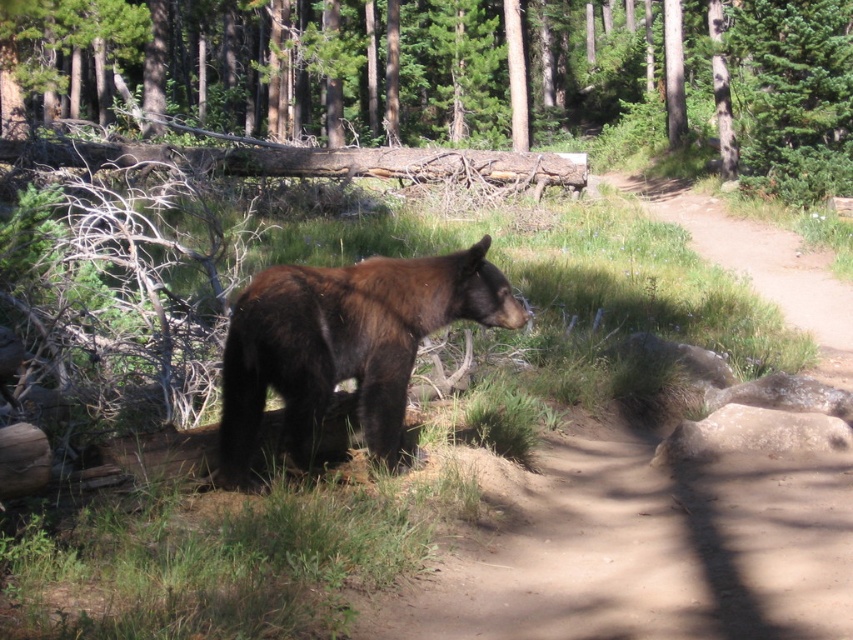
From the picture: Can you confirm if brown rough log at center is thinner than brown furry bear at center?

No.

In the scene shown: Who is more distant from viewer, (x=212, y=83) or (x=407, y=268)?

Positioned behind is point (x=212, y=83).

Identify the location of brown rough log at center. This screenshot has height=640, width=853. (447, 81).